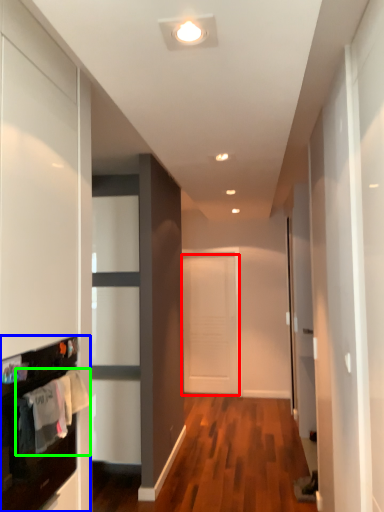
Question: Which is nearer to the door (highlighted by a red box)? cabinetry (highlighted by a blue box) or laundry (highlighted by a green box).

Choices:
 (A) cabinetry
 (B) laundry

Answer: (A)